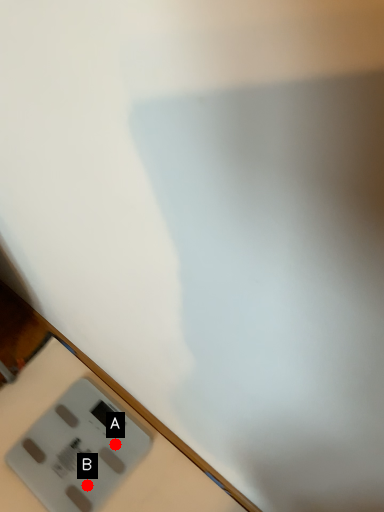
Question: Two points are circled on the image, labeled by A and B beside each circle. Which point is farther to the camera?

Choices:
 (A) A is further
 (B) B is further

Answer: (A)